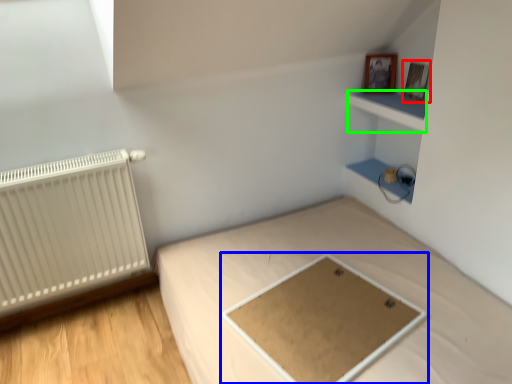
Question: Estimate the real-world distances between objects in this image. Which object is closer to picture frame (highlighted by a red box), table (highlighted by a blue box) or cabinet (highlighted by a green box)?

Choices:
 (A) table
 (B) cabinet

Answer: (B)